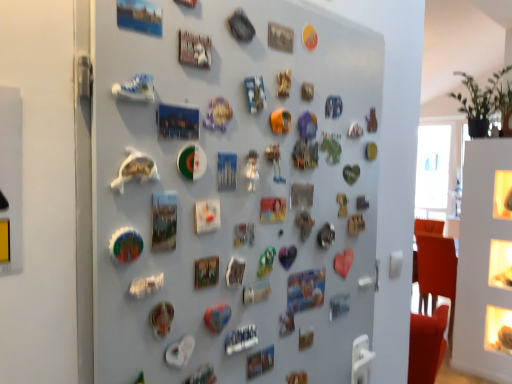
Question: Considering the relative sizes of green matte magnet at center, the 3th button from the right, and matte plastic button at center, the 3th button when ordered from top to bottom, in the image provided, is green matte magnet at center, the 3th button from the right, taller than matte plastic button at center, the 3th button when ordered from top to bottom,?

Choices:
 (A) yes
 (B) no

Answer: (B)

Question: Can you confirm if green matte magnet at center, which is the 1th button in front-to-back order, is positioned to the left of matte plastic button at center, the 1th button viewed from the right?

Choices:
 (A) yes
 (B) no

Answer: (A)

Question: Is green matte magnet at center, the 2th button positioned from the bottom, facing towards matte plastic button at center, the 3th button when ordered from top to bottom?

Choices:
 (A) yes
 (B) no

Answer: (B)

Question: Does green matte magnet at center, which is the first button in left-to-right order, have a lesser height compared to matte plastic button at center, positioned as the first button in bottom-to-top order?

Choices:
 (A) yes
 (B) no

Answer: (A)

Question: Is green matte magnet at center, which is the 1th button in front-to-back order, oriented away from matte plastic button at center, positioned as the first button in bottom-to-top order?

Choices:
 (A) no
 (B) yes

Answer: (A)

Question: Is green matte magnet at center, the second button when ordered from top to bottom, thinner than matte plastic button at center, the third button when ordered from front to back?

Choices:
 (A) yes
 (B) no

Answer: (A)

Question: From a real-world perspective, is green matte magnet at center, the 2th button positioned from the bottom, positioned over metallic silver button at upper center, the 1th button viewed from the top, based on gravity?

Choices:
 (A) no
 (B) yes

Answer: (A)

Question: Is the position of green matte magnet at center, which is the 1th button in front-to-back order, less distant than that of metallic silver button at upper center, which appears as the 2th button when viewed from the right?

Choices:
 (A) yes
 (B) no

Answer: (A)

Question: Is green matte magnet at center, the 3th button from the right, at the left side of metallic silver button at upper center, placed as the second button when sorted from front to back?

Choices:
 (A) no
 (B) yes

Answer: (B)

Question: Can you confirm if green matte magnet at center, the 2th button positioned from the bottom, is taller than metallic silver button at upper center, placed as the second button when sorted from front to back?

Choices:
 (A) no
 (B) yes

Answer: (B)

Question: Does green matte magnet at center, which is the third button in back-to-front order, have a lesser width compared to metallic silver button at upper center, the 1th button viewed from the top?

Choices:
 (A) no
 (B) yes

Answer: (B)

Question: From the image's perspective, would you say green matte magnet at center, which is the third button in back-to-front order, is positioned over metallic silver button at upper center, acting as the second button starting from the left?

Choices:
 (A) yes
 (B) no

Answer: (B)

Question: Is metallic silver button at upper center, acting as the 2th button starting from the back, next to green matte magnet at center, the 3th button from the right?

Choices:
 (A) yes
 (B) no

Answer: (B)